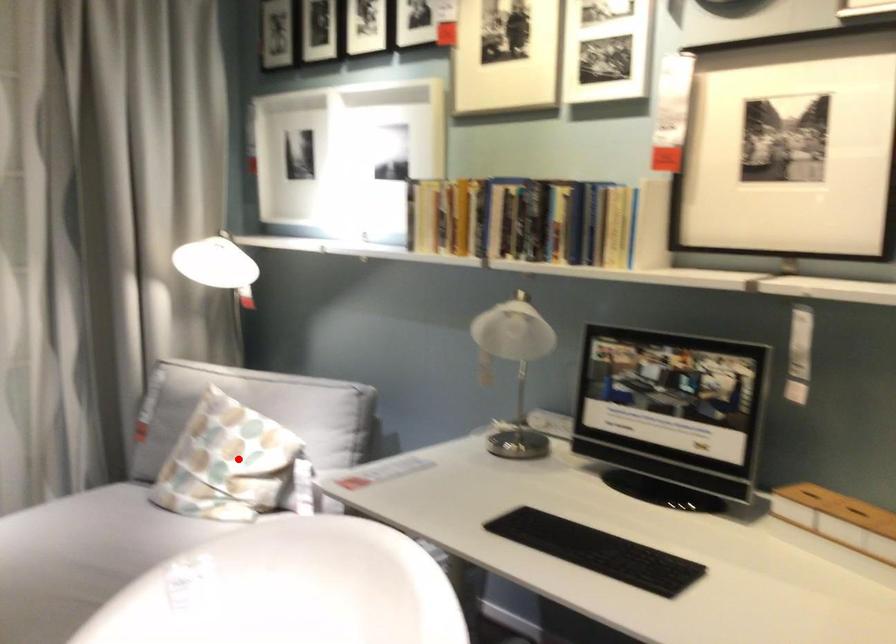
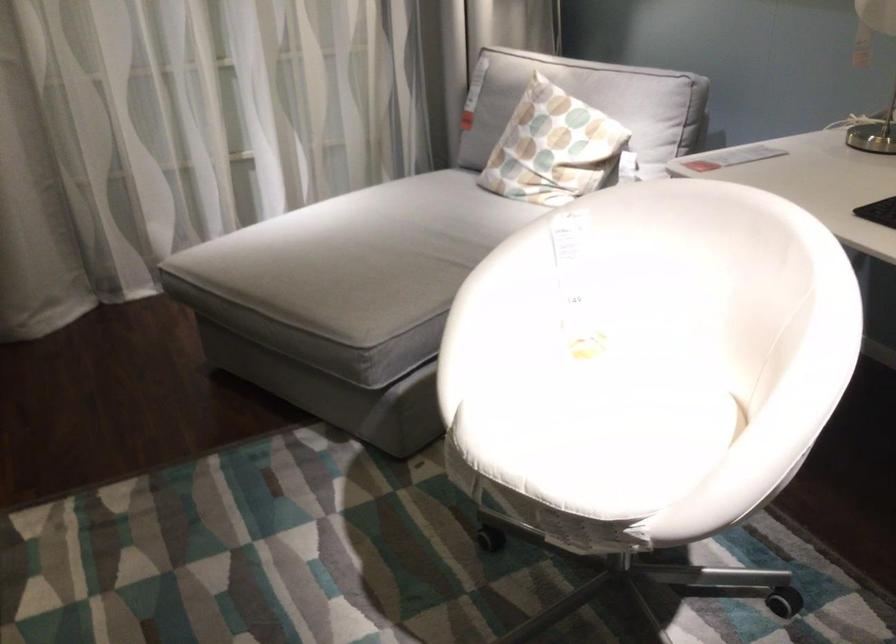
Locate, in the second image, the point that corresponds to the highlighted location in the first image.

(553, 147)